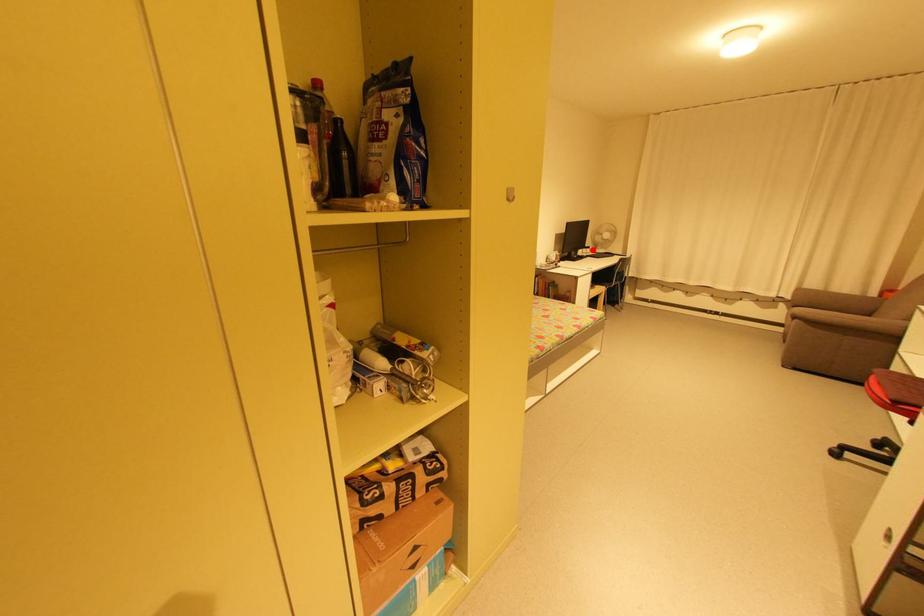
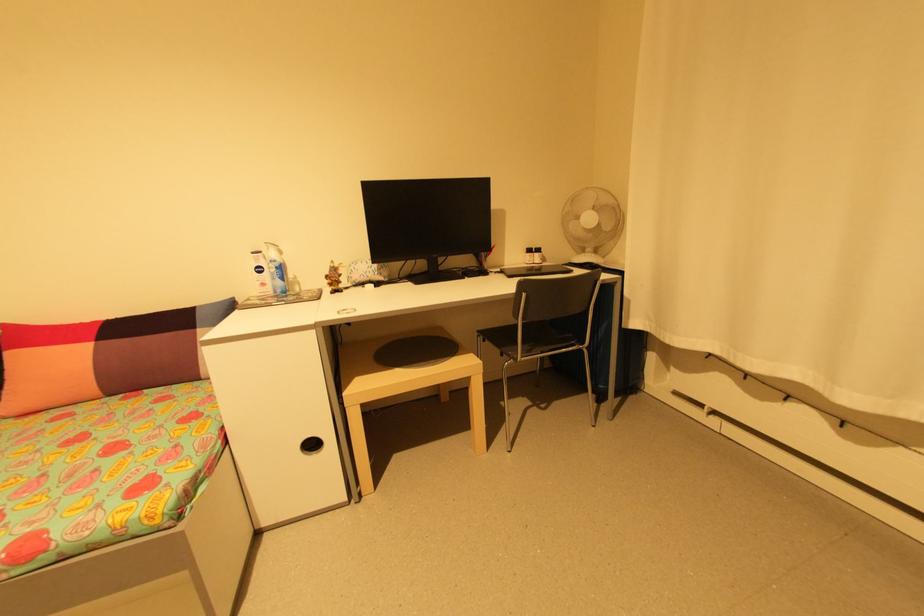
Question: I am providing you with two images of the same scene from different viewpoints. A red point is marked on the first image. At the location where the point appears in image 1, is it still visible in image 2?

Choices:
 (A) Yes
 (B) No

Answer: (A)